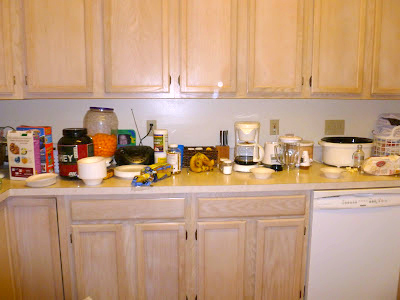
In order to click on plastic plates in this screenshot , I will do `click(133, 169)`.